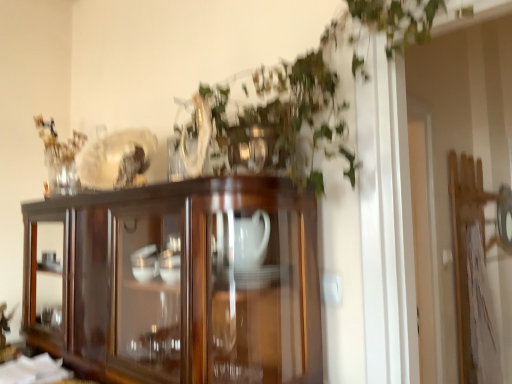
Question: From a real-world perspective, is green leafy plant at upper center positioned over dark wood cupboard at center based on gravity?

Choices:
 (A) no
 (B) yes

Answer: (B)

Question: From the image's perspective, is green leafy plant at upper center over dark wood cupboard at center?

Choices:
 (A) yes
 (B) no

Answer: (A)

Question: Is green leafy plant at upper center in contact with dark wood cupboard at center?

Choices:
 (A) yes
 (B) no

Answer: (B)

Question: Does green leafy plant at upper center have a greater width compared to dark wood cupboard at center?

Choices:
 (A) no
 (B) yes

Answer: (B)

Question: Does green leafy plant at upper center appear on the right side of dark wood cupboard at center?

Choices:
 (A) no
 (B) yes

Answer: (B)

Question: Can we say green leafy plant at upper center lies outside dark wood cupboard at center?

Choices:
 (A) no
 (B) yes

Answer: (B)

Question: From the image's perspective, does dark wood cupboard at center appear lower than green leafy plant at upper center?

Choices:
 (A) yes
 (B) no

Answer: (A)

Question: Is dark wood cupboard at center oriented towards green leafy plant at upper center?

Choices:
 (A) no
 (B) yes

Answer: (A)

Question: Does dark wood cupboard at center have a greater width compared to green leafy plant at upper center?

Choices:
 (A) yes
 (B) no

Answer: (B)

Question: Is dark wood cupboard at center behind green leafy plant at upper center?

Choices:
 (A) yes
 (B) no

Answer: (A)

Question: Does dark wood cupboard at center have a larger size compared to green leafy plant at upper center?

Choices:
 (A) yes
 (B) no

Answer: (A)

Question: From the image's perspective, is dark wood cupboard at center located above green leafy plant at upper center?

Choices:
 (A) no
 (B) yes

Answer: (A)

Question: Is dark wood cupboard at center bigger or smaller than green leafy plant at upper center?

Choices:
 (A) big
 (B) small

Answer: (A)